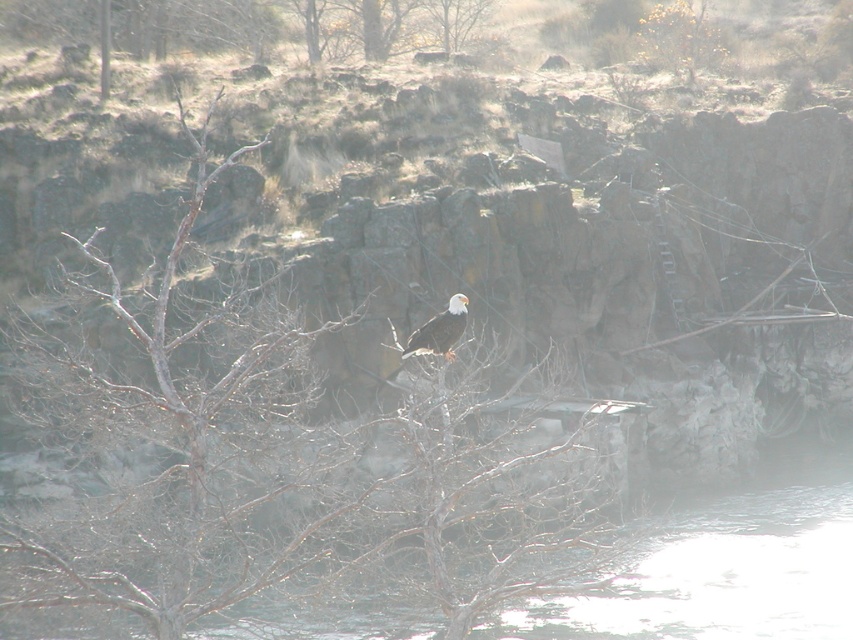
Does bare branches at center come behind white feathered eagle at center?

No, bare branches at center is in front of white feathered eagle at center.

How distant is bare branches at center from white feathered eagle at center?

They are 4.88 meters apart.

At what (x,y) coordinates should I click in order to perform the action: click on bare branches at center. Please return your answer as a coordinate pair (x, y). Looking at the image, I should click on (279, 474).

The height and width of the screenshot is (640, 853). In order to click on bare branches at center in this screenshot , I will do `click(279, 474)`.